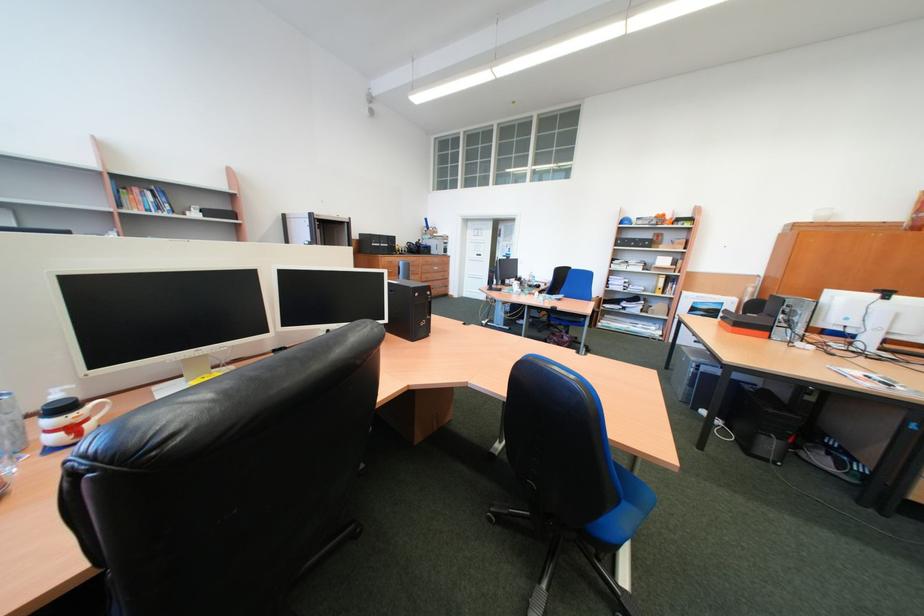
I want to click on white door handle, so click(485, 264).